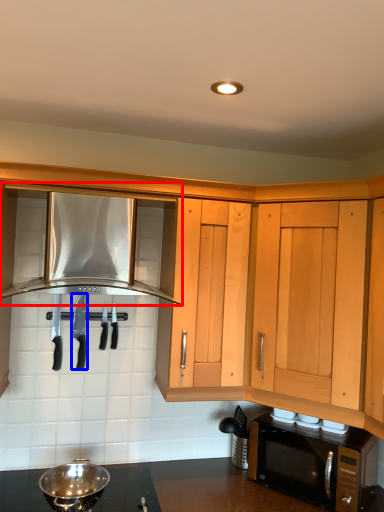
Question: Which object is closer to the camera taking this photo, cabinetry (highlighted by a red box) or knife (highlighted by a blue box)?

Choices:
 (A) cabinetry
 (B) knife

Answer: (A)